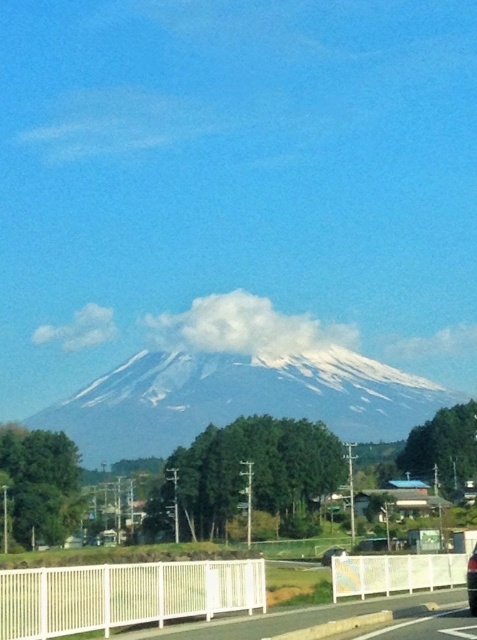
Is white snow-covered mountain at center to the right of metallic silver car at center from the viewer's perspective?

In fact, white snow-covered mountain at center is to the left of metallic silver car at center.

Which is above, white snow-covered mountain at center or metallic silver car at center?

Positioned higher is metallic silver car at center.

The width and height of the screenshot is (477, 640). In order to click on white snow-covered mountain at center in this screenshot , I will do `click(238, 397)`.

Locate an element on the screen. The height and width of the screenshot is (640, 477). white snow-covered mountain at center is located at coordinates (238, 397).